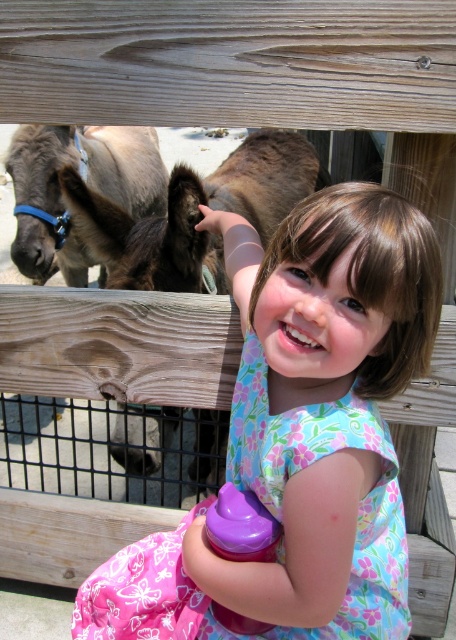
Question: Is brown fuzzy donkey at left wider than brown fuzzy donkey at upper left?

Choices:
 (A) no
 (B) yes

Answer: (B)

Question: Does brown fuzzy donkey at left appear on the left side of brown fuzzy donkey at upper left?

Choices:
 (A) yes
 (B) no

Answer: (B)

Question: Where is floral fabric dress at center located in relation to brown fuzzy donkey at left in the image?

Choices:
 (A) above
 (B) below

Answer: (B)

Question: Which point is closer to the camera taking this photo?

Choices:
 (A) (24, 236)
 (B) (228, 160)
 (C) (253, 429)

Answer: (C)

Question: Among these points, which one is farthest from the camera?

Choices:
 (A) [103, 164]
 (B) [124, 406]

Answer: (A)

Question: Which point is farther to the camera?

Choices:
 (A) (25, 276)
 (B) (319, 515)

Answer: (A)